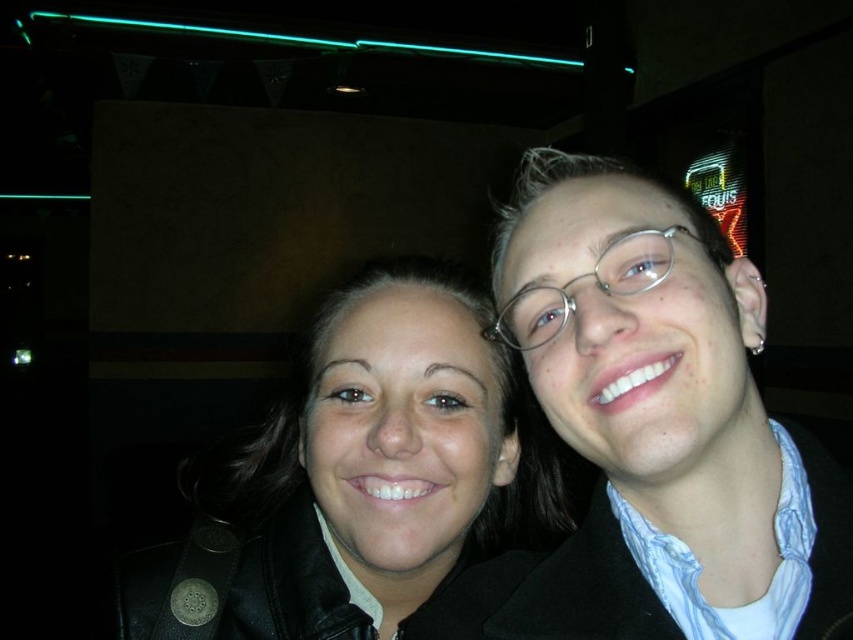
You are a photographer trying to capture a group photo of two people wearing matte black jackets. You notice that the matte black jacket at right and the matte black jacket at center are positioned in the scene. Based on their current positions, can you estimate whether there is enough space between them to fit another person standing sideways?

The distance between the matte black jacket at right and the matte black jacket at center is 14.22 centimeters. Since an average person standing sideways occupies about 40 centimeters of space, there isn

You are a photographer trying to capture a clear shot of both the matte black jacket at right and the matte black jacket at center. Based on their positions, which jacket is blocking the view of the other?

The matte black jacket at right is in front of the matte black jacket at center, so it is blocking the view of the latter.